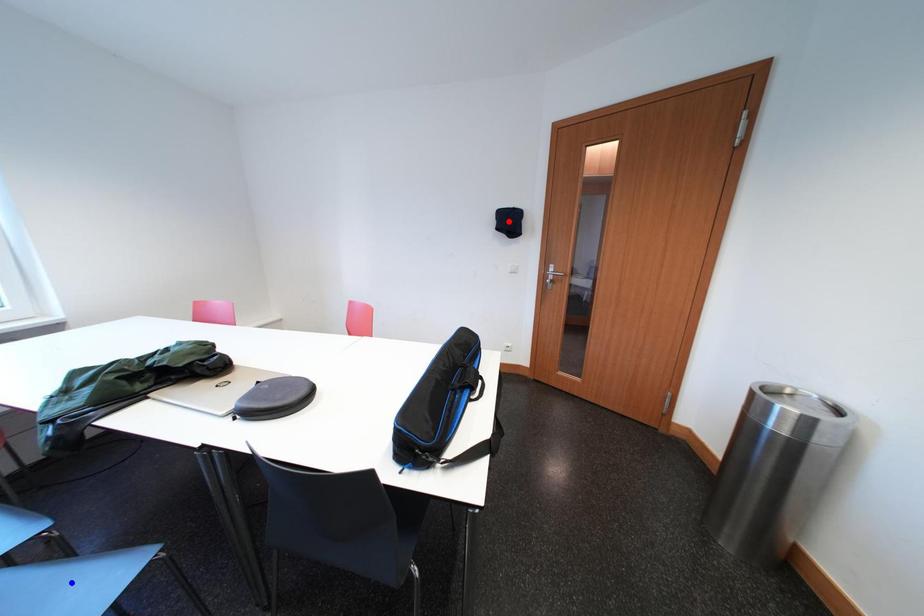
Question: In the image, two points are highlighted. Which point is nearer to the camera? Reply with the corresponding letter.

Choices:
 (A) blue point
 (B) red point

Answer: (A)